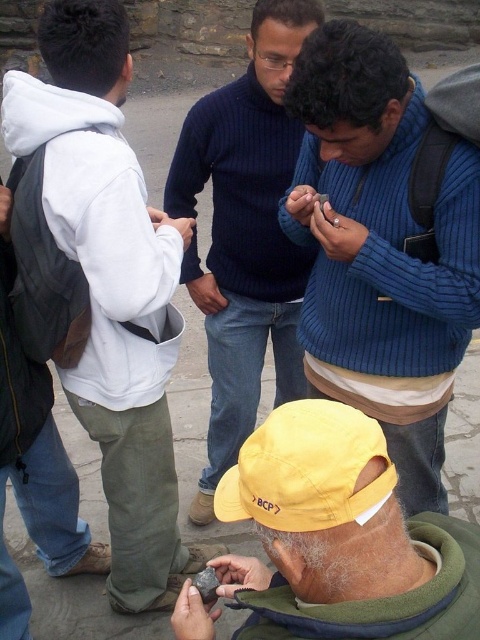
Is dark blue sweater at center taller than yellow fabric baseball cap at lower center?

Correct, dark blue sweater at center is much taller as yellow fabric baseball cap at lower center.

Measure the distance between point [295,308] and camera.

A distance of 8.72 feet exists between point [295,308] and camera.

Is point (240, 186) positioned after point (372, 449)?

Yes, point (240, 186) is behind point (372, 449).

Locate an element on the screen. This screenshot has width=480, height=640. dark blue sweater at center is located at coordinates (244, 234).

Does yellow fabric cap at upper center appear over dark blue sweater at center?

No, yellow fabric cap at upper center is not above dark blue sweater at center.

Can you confirm if yellow fabric cap at upper center is positioned to the right of dark blue sweater at center?

Incorrect, yellow fabric cap at upper center is not on the right side of dark blue sweater at center.

Does point (97, 26) come farther from viewer compared to point (300, 124)?

No, (97, 26) is in front of (300, 124).

In order to click on yellow fabric cap at upper center in this screenshot , I will do `click(111, 288)`.

Does point (85, 269) lie behind point (321, 403)?

Yes, it is.

Is yellow fabric cap at upper center to the right of yellow fabric baseball cap at lower center from the viewer's perspective?

In fact, yellow fabric cap at upper center is to the left of yellow fabric baseball cap at lower center.

Identify the location of yellow fabric cap at upper center. (111, 288).

Where is `yellow fabric cap at upper center`? The height and width of the screenshot is (640, 480). yellow fabric cap at upper center is located at coordinates (111, 288).